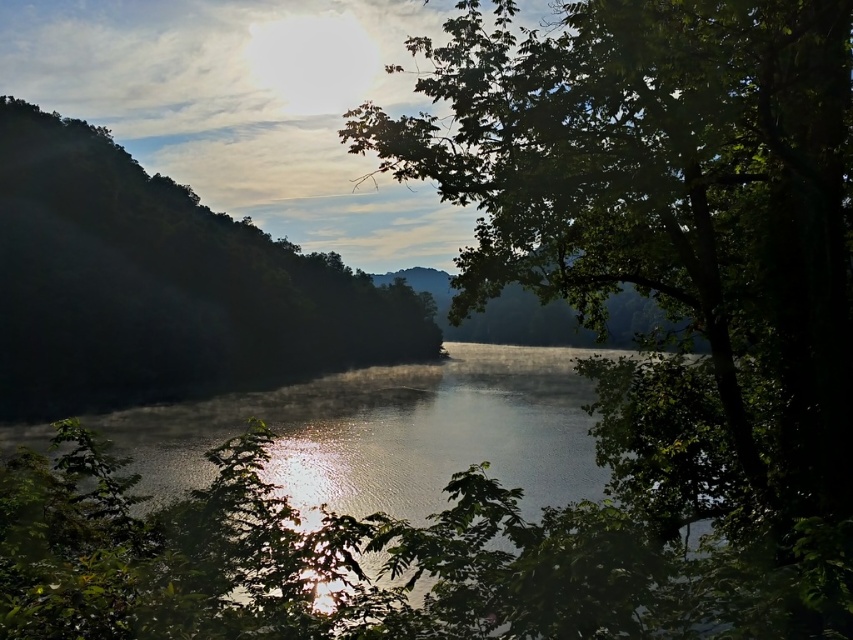
You are standing at the edge of the water and see the green leafy tree at center and the glistening water at center. Which object is positioned to the right side?

The green leafy tree at center is positioned to the right of the glistening water at center.

You are standing in the serene natural scene with a green leafy tree at left. If you want to take a photo of the tree, where should you position yourself relative to the tree to ensure it is centered in your camera viewfinder?

To center the green leafy tree at left in your camera viewfinder, position yourself directly in front of it, aligning the tree with the center point of your viewfinder. Since the tree is located at coordinates approximately 0.447 on the x and 0.190 on the y axis, you should aim your camera towards those coordinates to capture it centrally.